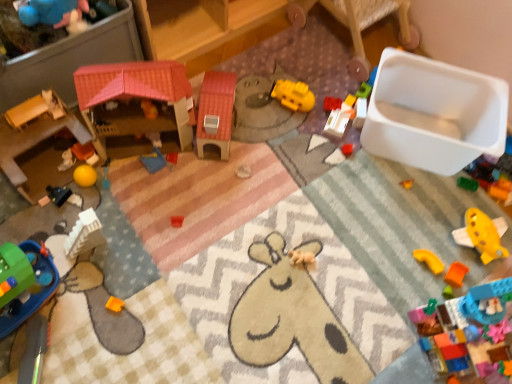
The image size is (512, 384). Find the location of `free space between yellow plastic block at upper center, the fifth toy from the right, and green plastic toy at lower left, acting as the second toy starting from the left`. free space between yellow plastic block at upper center, the fifth toy from the right, and green plastic toy at lower left, acting as the second toy starting from the left is located at coordinates (205, 192).